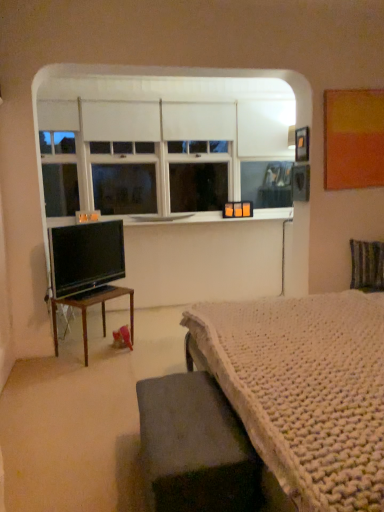
What do you see at coordinates (160, 142) in the screenshot? I see `white matte window at upper center` at bounding box center [160, 142].

Identify the location of striped fabric swivel chair at right. (367, 265).

Describe the element at coordinates (367, 265) in the screenshot. I see `striped fabric swivel chair at right` at that location.

What do you see at coordinates (92, 305) in the screenshot? This screenshot has height=512, width=384. I see `wooden table at left, placed as the 1th table when sorted from back to front` at bounding box center [92, 305].

How much space does dark gray fabric ottoman at lower center, positioned as the second table in back-to-front order, occupy vertically?

It is 15.02 inches.

Locate an element on the screen. white matte window at upper center is located at coordinates (160, 142).

Which object is further away from the camera, striped fabric swivel chair at right or dark gray fabric ottoman at lower center, positioned as the second table in back-to-front order?

striped fabric swivel chair at right is more distant.

How many degrees apart are the facing directions of striped fabric swivel chair at right and dark gray fabric ottoman at lower center, the 1th table positioned from the right?

The facing directions of striped fabric swivel chair at right and dark gray fabric ottoman at lower center, the 1th table positioned from the right, are 80.7 degrees apart.

Is striped fabric swivel chair at right beside dark gray fabric ottoman at lower center, the 1th table positioned from the right?

No, striped fabric swivel chair at right is not in contact with dark gray fabric ottoman at lower center, the 1th table positioned from the right.

From a real-world perspective, is striped fabric swivel chair at right on top of dark gray fabric ottoman at lower center, the second table viewed from the left?

Yes, from a real-world perspective, striped fabric swivel chair at right is on top of dark gray fabric ottoman at lower center, the second table viewed from the left.

Is white matte window at upper center positioned far away from white smooth window sill at center?

white matte window at upper center is actually quite close to white smooth window sill at center.

Considering the sizes of white matte window at upper center and white smooth window sill at center in the image, is white matte window at upper center taller or shorter than white smooth window sill at center?

In the image, white matte window at upper center appears to be taller than white smooth window sill at center.

Considering the sizes of white matte window at upper center and white smooth window sill at center in the image, is white matte window at upper center wider or thinner than white smooth window sill at center?

In the image, white matte window at upper center appears to be more narrow than white smooth window sill at center.

Can you tell me how much white matte window at upper center and white smooth window sill at center differ in facing direction?

There is a 0.00151-degree angle between the facing directions of white matte window at upper center and white smooth window sill at center.

Which is more to the left, white smooth window sill at center or dark gray fabric ottoman at lower center, the 1th table positioned from the right?

Positioned to the left is white smooth window sill at center.

Is white smooth window sill at center aimed at dark gray fabric ottoman at lower center, the first table viewed from the front?

No, white smooth window sill at center does not turn towards dark gray fabric ottoman at lower center, the first table viewed from the front.

Is white smooth window sill at center smaller than dark gray fabric ottoman at lower center, the 1th table positioned from the right?

Yes.

Between point (228, 221) and point (198, 456), which one is positioned behind?

The point (228, 221) is farther from the camera.

Which is behind, point (172, 430) or point (213, 114)?

The point (213, 114) is farther.

Is dark gray fabric ottoman at lower center, the second table viewed from the left, inside or outside of white matte window at upper center?

dark gray fabric ottoman at lower center, the second table viewed from the left, exists outside the volume of white matte window at upper center.

From a real-world perspective, is dark gray fabric ottoman at lower center, the 1th table positioned from the right, positioned above or below white matte window at upper center?

Clearly, from a real-world perspective, dark gray fabric ottoman at lower center, the 1th table positioned from the right, is below white matte window at upper center.

Locate an element on the screen. The image size is (384, 512). window above the dark gray fabric ottoman at lower center, the second table viewed from the left (from the image's perspective) is located at coordinates (160, 142).

The width and height of the screenshot is (384, 512). I want to click on table to the left of white smooth window sill at center, so click(92, 305).

Would you say wooden table at left, which is counted as the first table, starting from the left, is outside white smooth window sill at center?

Indeed, wooden table at left, which is counted as the first table, starting from the left, is completely outside white smooth window sill at center.

Is point (124, 294) positioned before point (285, 212)?

Yes, point (124, 294) is closer to viewer.

From a real-world perspective, which object rests below the other?

In real-world perspective, wooden table at left, placed as the 1th table when sorted from back to front, is lower.

At what (x,y) coordinates should I click in order to perform the action: click on swivel chair located above the white knitted blanket at lower right (from the image's perspective). Please return your answer as a coordinate pair (x, y). Looking at the image, I should click on (367, 265).

What's the angular difference between striped fabric swivel chair at right and white knitted blanket at lower right's facing directions?

80.6 degrees separate the facing orientations of striped fabric swivel chair at right and white knitted blanket at lower right.

Considering the sizes of objects striped fabric swivel chair at right and white knitted blanket at lower right in the image provided, who is thinner, striped fabric swivel chair at right or white knitted blanket at lower right?

Thinner between the two is striped fabric swivel chair at right.

Considering the sizes of objects striped fabric swivel chair at right and white knitted blanket at lower right in the image provided, who is bigger, striped fabric swivel chair at right or white knitted blanket at lower right?

white knitted blanket at lower right is bigger.

Is striped fabric swivel chair at right further to the viewer compared to white matte window at upper center?

That is False.

Is striped fabric swivel chair at right at the left side of white matte window at upper center?

Incorrect, striped fabric swivel chair at right is not on the left side of white matte window at upper center.

Between striped fabric swivel chair at right and white matte window at upper center, which one has more height?

white matte window at upper center is taller.

Does striped fabric swivel chair at right have a greater width compared to white matte window at upper center?

In fact, striped fabric swivel chair at right might be narrower than white matte window at upper center.

At what (x,y) coordinates should I click in order to perform the action: click on swivel chair located above the dark gray fabric ottoman at lower center, positioned as the second table in back-to-front order (from a real-world perspective). Please return your answer as a coordinate pair (x, y). Looking at the image, I should click on (367, 265).

I want to click on window sill on the right of white matte window at upper center, so click(202, 217).

Which object lies nearer to the anchor point wooden table at left, acting as the second table starting from the front, white smooth window sill at center or dark gray fabric ottoman at lower center, the 1th table positioned from the right?

white smooth window sill at center lies closer to wooden table at left, acting as the second table starting from the front, than the other object.

When comparing their distances from white knitted blanket at lower right, does striped fabric swivel chair at right or wooden table at left, placed as the 1th table when sorted from back to front, seem further?

Among the two, striped fabric swivel chair at right is located further to white knitted blanket at lower right.

Estimate the real-world distances between objects in this image. Which object is further from black glossy tv at left, wooden table at left, which appears as the second table when viewed from the right, or white matte window at upper center?

white matte window at upper center is further to black glossy tv at left.

Estimate the real-world distances between objects in this image. Which object is further from white matte window at upper center, black glossy tv at left or white knitted blanket at lower right?

white knitted blanket at lower right is further to white matte window at upper center.

Which object lies further to the anchor point dark gray fabric ottoman at lower center, the second table viewed from the left, white smooth window sill at center or white matte window at upper center?

white matte window at upper center lies further to dark gray fabric ottoman at lower center, the second table viewed from the left, than the other object.

Based on their spatial positions, is dark gray fabric ottoman at lower center, the second table viewed from the left, or wooden table at left, which appears as the second table when viewed from the right, further from striped fabric swivel chair at right?

The object further to striped fabric swivel chair at right is dark gray fabric ottoman at lower center, the second table viewed from the left.

Which object lies nearer to the anchor point dark gray fabric ottoman at lower center, the second table viewed from the left, white matte window at upper center or white smooth window sill at center?

white smooth window sill at center is positioned closer to the anchor dark gray fabric ottoman at lower center, the second table viewed from the left.

From the picture: Looking at the image, which one is located further to white smooth window sill at center, wooden table at left, acting as the second table starting from the front, or white knitted blanket at lower right?

white knitted blanket at lower right is positioned further to the anchor white smooth window sill at center.

I want to click on table between black glossy tv at left and white smooth window sill at center along the z-axis, so click(x=92, y=305).

Where is `television between dark gray fabric ottoman at lower center, the first table viewed from the front, and wooden table at left, which is counted as the first table, starting from the left, in the front-back direction`? This screenshot has height=512, width=384. television between dark gray fabric ottoman at lower center, the first table viewed from the front, and wooden table at left, which is counted as the first table, starting from the left, in the front-back direction is located at coordinates (85, 257).

Image resolution: width=384 pixels, height=512 pixels. Find the location of `window between black glossy tv at left and white smooth window sill at center in the front-back direction`. window between black glossy tv at left and white smooth window sill at center in the front-back direction is located at coordinates (160, 142).

Where is `window positioned between dark gray fabric ottoman at lower center, the first table viewed from the front, and white smooth window sill at center from near to far`? This screenshot has height=512, width=384. window positioned between dark gray fabric ottoman at lower center, the first table viewed from the front, and white smooth window sill at center from near to far is located at coordinates (160, 142).